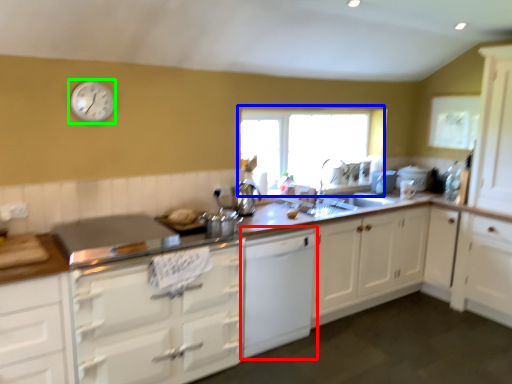
Question: Estimate the real-world distances between objects in this image. Which object is closer to cabinetry (highlighted by a red box), window (highlighted by a blue box) or clock (highlighted by a green box)?

Choices:
 (A) window
 (B) clock

Answer: (A)